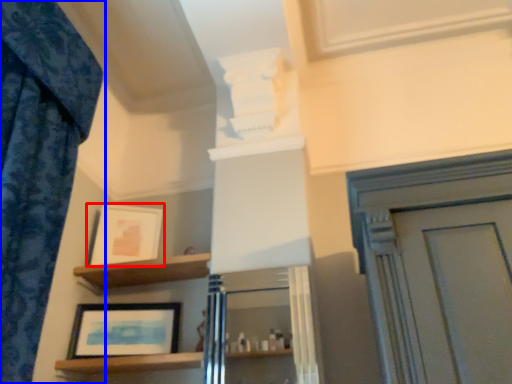
Question: Which of the following is the closest to the observer, picture frame (highlighted by a red box) or curtain (highlighted by a blue box)?

Choices:
 (A) picture frame
 (B) curtain

Answer: (B)